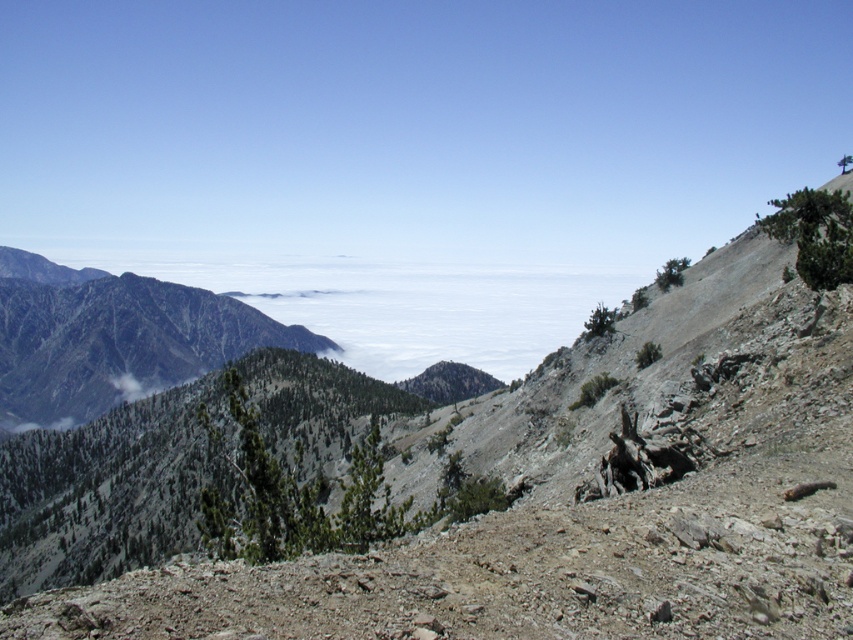
You are a hiker planning to traverse from the dull gray rock at center to the green textured mountain at left. Based on the distance between them, can you estimate how long it would take to walk this path if your average walking speed is 3 km per hour?

The distance between the dull gray rock at center and the green textured mountain at left is 462.21 meters. At an average walking speed of 3 km per hour, it would take approximately 9.24 minutes to cover this distance.

You are a hiker planning to descend from the dull gray rock at center to the green textured mountain at left. Based on the scene, which direction should you head to reach your destination?

The dull gray rock at center is positioned under the green textured mountain at left, so you should head downward to reach the green textured mountain at left.